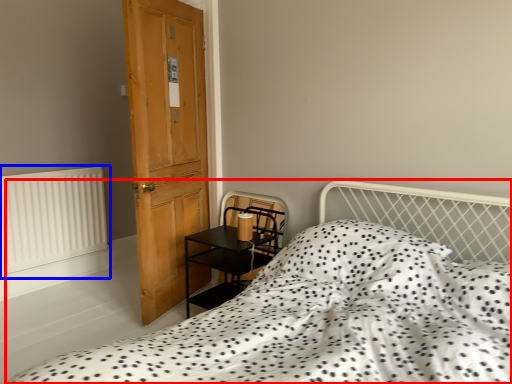
Question: Which point is further to the camera, bed (highlighted by a red box) or radiator (highlighted by a blue box)?

Choices:
 (A) bed
 (B) radiator

Answer: (B)